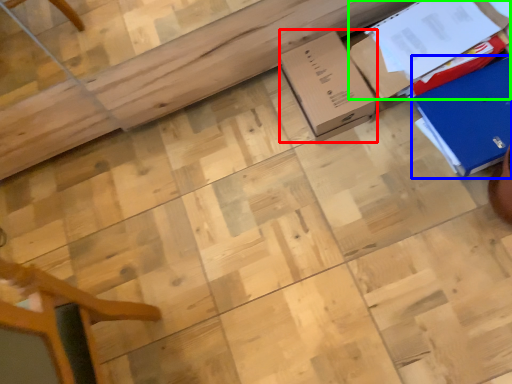
Question: Which object is the closest to the cardboard box (highlighted by a red box)? Choose among these: cardboard box (highlighted by a blue box) or cardboard box (highlighted by a green box).

Choices:
 (A) cardboard box
 (B) cardboard box

Answer: (B)